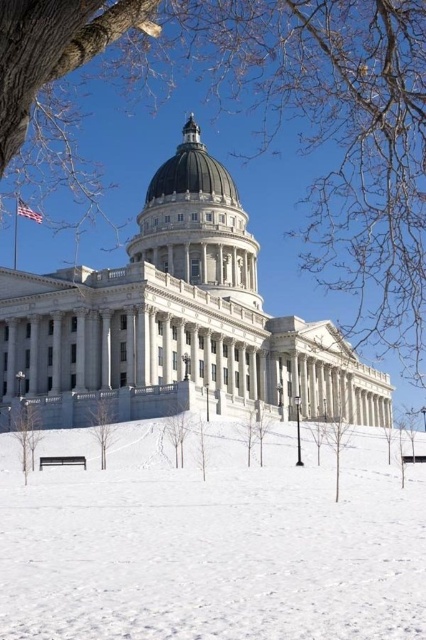
You are standing at the base of the grand neoclassical building and want to reach the point marked at coordinates point (x=212, y=532). Given that the distance between you and this point is 112.06 feet, can you estimate how long it would take to walk there if your walking speed is 3 feet per second?

The distance between you and the point (x=212, y=532) is 112.06 feet. At a walking speed of 3 feet per second, it would take approximately 37.35 seconds to reach the point.

You are standing in front of the grand neoclassical building and notice two trees in the snowy foreground. Which tree, the smooth brown tree at center or the green leafy tree at center, is positioned to the left?

The smooth brown tree at center is positioned to the left of the green leafy tree at center.

You are an architect visiting the state capitol and notice the white powdery snow at center and the smooth brown tree at center in the foreground. Which object is bigger in the image?

The white powdery snow at center is larger in size compared to the smooth brown tree at center.